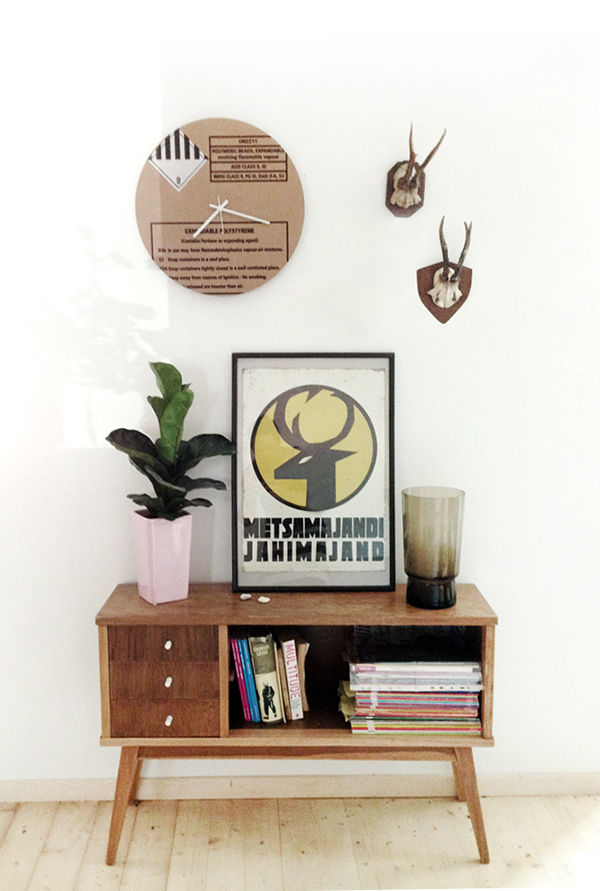
Where is `wooden legs`? wooden legs is located at coordinates (122, 788), (469, 787), (458, 780), (139, 773).